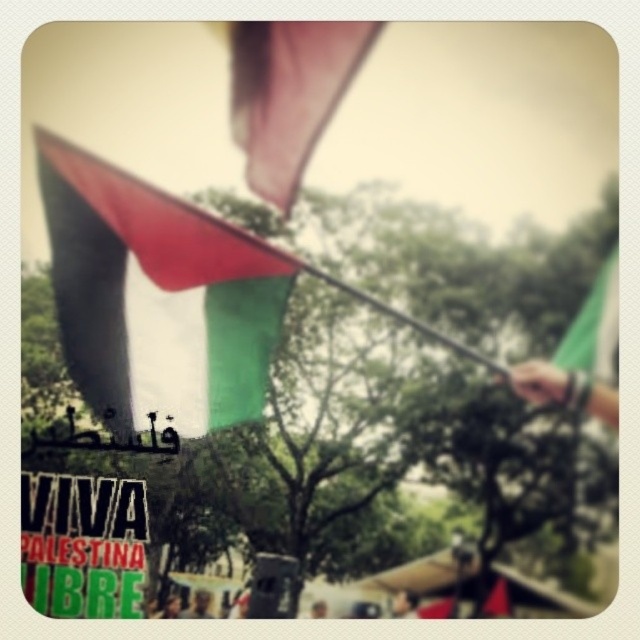
Question: Can you confirm if tri-color fabric flag at center is positioned to the left of silky pink fabric at upper center?

Choices:
 (A) yes
 (B) no

Answer: (A)

Question: Which point is farther from the camera taking this photo?

Choices:
 (A) (221, 342)
 (B) (289, 138)
 (C) (582, 308)

Answer: (A)

Question: From the image, what is the correct spatial relationship of tri-color fabric flag at center in relation to silky pink fabric at upper center?

Choices:
 (A) right
 (B) left

Answer: (B)

Question: Estimate the real-world distances between objects in this image. Which object is closer to the tri-color fabric flag at center?

Choices:
 (A) silky pink fabric at upper center
 (B) green fabric flag at upper right

Answer: (A)

Question: Which object is positioned closest to the green fabric flag at upper right?

Choices:
 (A) tri-color fabric flag at center
 (B) silky pink fabric at upper center

Answer: (B)

Question: Can you confirm if silky pink fabric at upper center is thinner than green fabric flag at upper right?

Choices:
 (A) yes
 (B) no

Answer: (B)